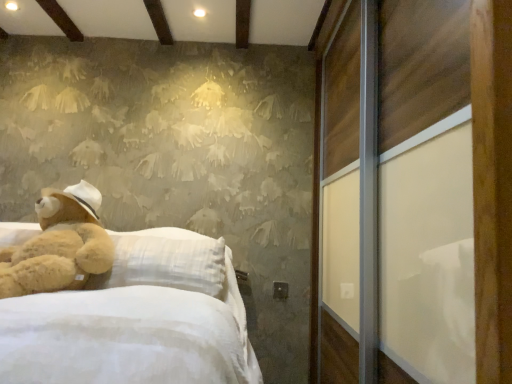
Measure the distance between point (45, 243) and camera.

Point (45, 243) and camera are 1.62 meters apart from each other.

This screenshot has width=512, height=384. Identify the location of soft brown plush at left. (x=59, y=245).

Image resolution: width=512 pixels, height=384 pixels. Describe the element at coordinates (59, 245) in the screenshot. I see `soft brown plush at left` at that location.

You are a GUI agent. You are given a task and a screenshot of the screen. Output one action in this format:
    pyautogui.click(x=<x>, y=<y>)
    Task: Click on the wooden sliding door at right
    
    Given the screenshot: What is the action you would take?
    pyautogui.click(x=425, y=192)

The image size is (512, 384). What do you see at coordinates (425, 192) in the screenshot?
I see `wooden sliding door at right` at bounding box center [425, 192].

The width and height of the screenshot is (512, 384). In order to click on soft brown plush at left in this screenshot , I will do `click(59, 245)`.

In the scene shown: Can you confirm if soft brown plush at left is positioned to the left of wooden sliding door at right?

Indeed, soft brown plush at left is positioned on the left side of wooden sliding door at right.

Is soft brown plush at left in front of wooden sliding door at right?

No, soft brown plush at left is behind wooden sliding door at right.

Which is behind, point (44, 216) or point (391, 316)?

The point (44, 216) is farther from the camera.

From the image's perspective, which is below, soft brown plush at left or wooden sliding door at right?

soft brown plush at left is shown below in the image.

From a real-world perspective, who is located lower, soft brown plush at left or wooden sliding door at right?

In real-world perspective, soft brown plush at left is lower.

Considering the sizes of objects soft brown plush at left and wooden sliding door at right in the image provided, who is wider, soft brown plush at left or wooden sliding door at right?

With larger width is wooden sliding door at right.

Who is taller, soft brown plush at left or wooden sliding door at right?

With more height is wooden sliding door at right.

Considering the sizes of objects soft brown plush at left and wooden sliding door at right in the image provided, who is bigger, soft brown plush at left or wooden sliding door at right?

wooden sliding door at right.

Is wooden sliding door at right completely or partially inside soft brown plush at left?

Definitely not — wooden sliding door at right is not inside soft brown plush at left.

In the scene shown: Would you say soft brown plush at left is a long distance from wooden sliding door at right?

Yes, soft brown plush at left and wooden sliding door at right are located far from each other.

Is soft brown plush at left aimed at wooden sliding door at right?

No, soft brown plush at left is not facing towards wooden sliding door at right.

What's the angular difference between soft brown plush at left and wooden sliding door at right's facing directions?

64.2 degrees.

Find the location of a particular element. This screenshot has width=512, height=384. screen door above the soft brown plush at left (from the image's perspective) is located at coordinates (425, 192).

Would you say wooden sliding door at right is to the left or to the right of soft brown plush at left in the picture?

wooden sliding door at right is to the right of soft brown plush at left.

Looking at this image, which object is further away from the camera, wooden sliding door at right or soft brown plush at left?

Positioned behind is soft brown plush at left.

Considering the points (423, 314) and (13, 258), which point is behind, point (423, 314) or point (13, 258)?

The point (13, 258) is more distant.

From the image's perspective, relative to soft brown plush at left, is wooden sliding door at right above or below?

wooden sliding door at right is situated higher than soft brown plush at left in the image.

From a real-world perspective, is wooden sliding door at right located beneath soft brown plush at left?

No, from a real-world perspective, wooden sliding door at right is not beneath soft brown plush at left.

From the picture: Which of these two, wooden sliding door at right or soft brown plush at left, is wider?

With larger width is wooden sliding door at right.

Considering the sizes of wooden sliding door at right and soft brown plush at left in the image, is wooden sliding door at right taller or shorter than soft brown plush at left?

wooden sliding door at right is taller than soft brown plush at left.

In terms of size, does wooden sliding door at right appear bigger or smaller than soft brown plush at left?

Clearly, wooden sliding door at right is larger in size than soft brown plush at left.

Would you say wooden sliding door at right is inside or outside soft brown plush at left?

wooden sliding door at right exists outside the volume of soft brown plush at left.

Is wooden sliding door at right touching soft brown plush at left?

There is a gap between wooden sliding door at right and soft brown plush at left.

Could you tell me if wooden sliding door at right is turned towards soft brown plush at left?

Yes, wooden sliding door at right is oriented towards soft brown plush at left.

How many degrees apart are the facing directions of wooden sliding door at right and soft brown plush at left?

They differ by 64.2 degrees in their facing directions.

How far apart are wooden sliding door at right and soft brown plush at left?

wooden sliding door at right is 1.12 meters away from soft brown plush at left.

The width and height of the screenshot is (512, 384). Find the location of `screen door that is above the soft brown plush at left (from a real-world perspective)`. screen door that is above the soft brown plush at left (from a real-world perspective) is located at coordinates (425, 192).

You are a GUI agent. You are given a task and a screenshot of the screen. Output one action in this format:
    pyautogui.click(x=<x>, y=<y>)
    Task: Click on the teddy bear to the left of wooden sliding door at right
    Image resolution: width=512 pixels, height=384 pixels.
    Given the screenshot: What is the action you would take?
    pyautogui.click(x=59, y=245)

You are a GUI agent. You are given a task and a screenshot of the screen. Output one action in this format:
    pyautogui.click(x=<x>, y=<y>)
    Task: Click on the teddy bear that appears behind the wooden sliding door at right
    The width and height of the screenshot is (512, 384).
    Given the screenshot: What is the action you would take?
    pyautogui.click(x=59, y=245)